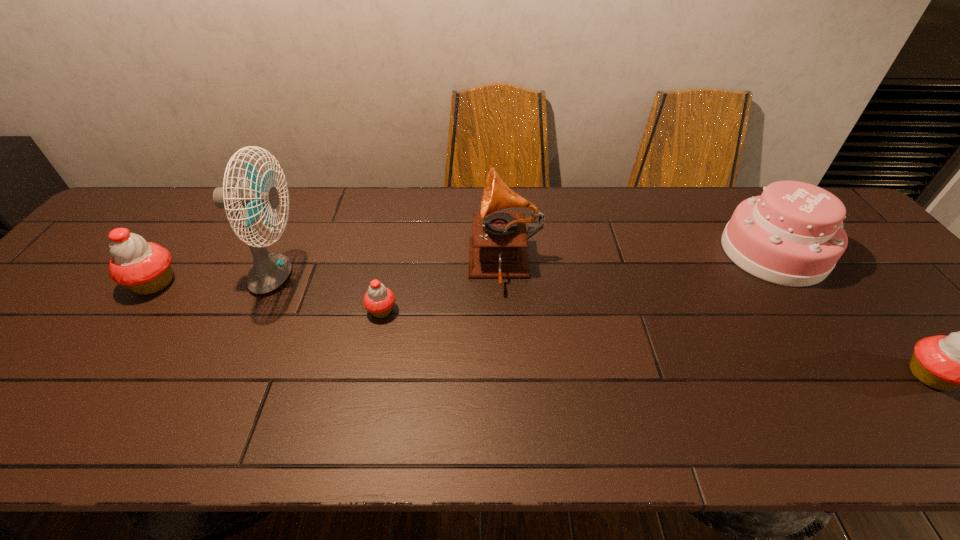
Where is `free space located 0.110m on the front-facing side of the fifth object from right to left`? This screenshot has width=960, height=540. free space located 0.110m on the front-facing side of the fifth object from right to left is located at coordinates (347, 279).

The width and height of the screenshot is (960, 540). Identify the location of free space located on the left of the birthday cake. (660, 252).

Identify the location of vacant space situated on the horn of the third object from right to left. (450, 266).

Where is `vacant space situated 0.190m on the horn of the third object from right to left`? This screenshot has width=960, height=540. vacant space situated 0.190m on the horn of the third object from right to left is located at coordinates (399, 266).

Locate an element on the screen. The height and width of the screenshot is (540, 960). blank area located 0.070m on the horn of the third object from right to left is located at coordinates (444, 266).

Locate an element on the screen. Image resolution: width=960 pixels, height=540 pixels. object that is at the far edge is located at coordinates (792, 235).

The image size is (960, 540). I want to click on object that is at the right edge, so click(792, 235).

You are a GUI agent. You are given a task and a screenshot of the screen. Output one action in this format:
    pyautogui.click(x=<x>, y=<y>)
    Task: Click on the object located at the far right corner
    Image resolution: width=960 pixels, height=540 pixels.
    Given the screenshot: What is the action you would take?
    pyautogui.click(x=792, y=235)

In the image, there is a desktop. At what (x,y) coordinates should I click in order to perform the action: click on vacant area at the far edge. Please return your answer as a coordinate pair (x, y). Image resolution: width=960 pixels, height=540 pixels. Looking at the image, I should click on (600, 214).

In the image, there is a desktop. In order to click on vacant space at the near edge in this screenshot , I will do `click(410, 384)`.